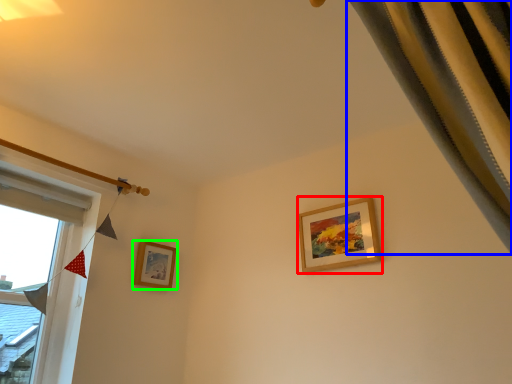
Question: Which object is the closest to the picture frame (highlighted by a red box)? Choose among these: curtain (highlighted by a blue box) or picture frame (highlighted by a green box).

Choices:
 (A) curtain
 (B) picture frame

Answer: (B)